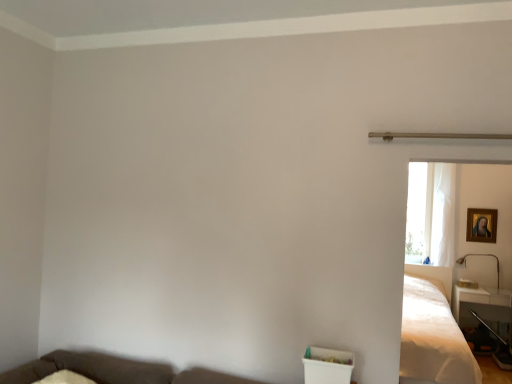
Question: Does metallic gold lamp at right have a lesser height compared to brown fabric couch at lower left?

Choices:
 (A) no
 (B) yes

Answer: (A)

Question: Can you confirm if metallic gold lamp at right is wider than brown fabric couch at lower left?

Choices:
 (A) no
 (B) yes

Answer: (A)

Question: Is metallic gold lamp at right next to brown fabric couch at lower left?

Choices:
 (A) no
 (B) yes

Answer: (A)

Question: From a real-world perspective, does metallic gold lamp at right stand above brown fabric couch at lower left?

Choices:
 (A) no
 (B) yes

Answer: (B)

Question: Considering the relative sizes of metallic gold lamp at right and brown fabric couch at lower left in the image provided, is metallic gold lamp at right smaller than brown fabric couch at lower left?

Choices:
 (A) yes
 (B) no

Answer: (A)

Question: Is point (121, 372) closer or farther from the camera than point (444, 230)?

Choices:
 (A) closer
 (B) farther

Answer: (A)

Question: From a real-world perspective, is brown fabric couch at lower left above or below white sheer curtain at right?

Choices:
 (A) above
 (B) below

Answer: (B)

Question: From the image's perspective, is brown fabric couch at lower left located above or below white sheer curtain at right?

Choices:
 (A) below
 (B) above

Answer: (A)

Question: Is brown fabric couch at lower left situated inside white sheer curtain at right or outside?

Choices:
 (A) inside
 (B) outside

Answer: (B)

Question: From a real-world perspective, is white glossy table at lower right positioned above or below metallic gold lamp at right?

Choices:
 (A) below
 (B) above

Answer: (A)

Question: Is point (498, 306) closer or farther from the camera than point (466, 253)?

Choices:
 (A) farther
 (B) closer

Answer: (B)

Question: Is white glossy table at lower right in front of or behind metallic gold lamp at right in the image?

Choices:
 (A) front
 (B) behind

Answer: (A)

Question: From the image's perspective, is white glossy table at lower right above or below metallic gold lamp at right?

Choices:
 (A) below
 (B) above

Answer: (A)

Question: Relative to brown fabric couch at lower left, is white sheer curtain at right in front or behind?

Choices:
 (A) behind
 (B) front

Answer: (A)

Question: Considering the positions of white sheer curtain at right and brown fabric couch at lower left in the image, is white sheer curtain at right bigger or smaller than brown fabric couch at lower left?

Choices:
 (A) big
 (B) small

Answer: (B)